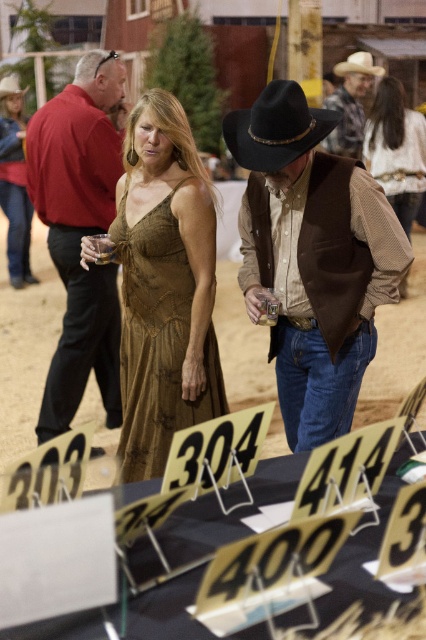
Question: Which point appears closest to the camera in this image?

Choices:
 (A) (28, 349)
 (B) (374, 160)
 (C) (8, 173)
 (D) (359, 364)

Answer: (D)

Question: Can you confirm if matte red shirt at center is positioned to the left of gold textured dress at center?

Choices:
 (A) yes
 (B) no

Answer: (A)

Question: Which object is the farthest from the brown suede cowboy hat at center?

Choices:
 (A) brown leather cowboy hat at upper right
 (B) matte red shirt at center
 (C) brown dirt track at center
 (D) light brown felt cowboy hat at upper center

Answer: (D)

Question: From the image, what is the correct spatial relationship of matte gold dress at upper left in relation to light brown felt cowboy hat at upper center?

Choices:
 (A) right
 (B) left

Answer: (B)

Question: Where is gold textured dress at center located in relation to white textured shirt at upper right in the image?

Choices:
 (A) left
 (B) right

Answer: (A)

Question: Which object is positioned farthest from the brown dirt track at center?

Choices:
 (A) brown suede cowboy hat at center
 (B) matte red shirt at center
 (C) light brown felt cowboy hat at upper center

Answer: (C)